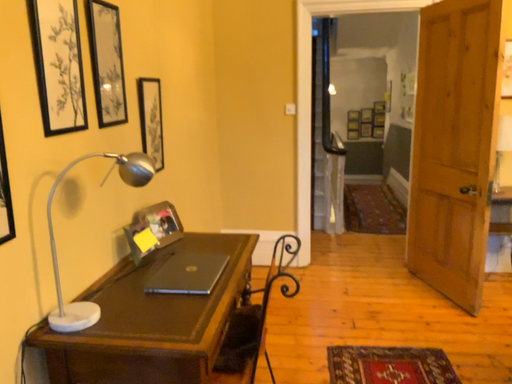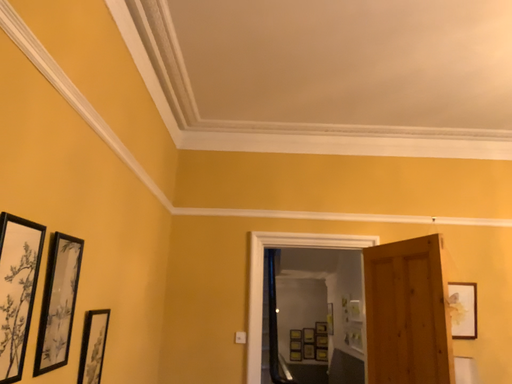
Question: How did the camera likely rotate when shooting the video?

Choices:
 (A) rotated right
 (B) rotated left

Answer: (A)